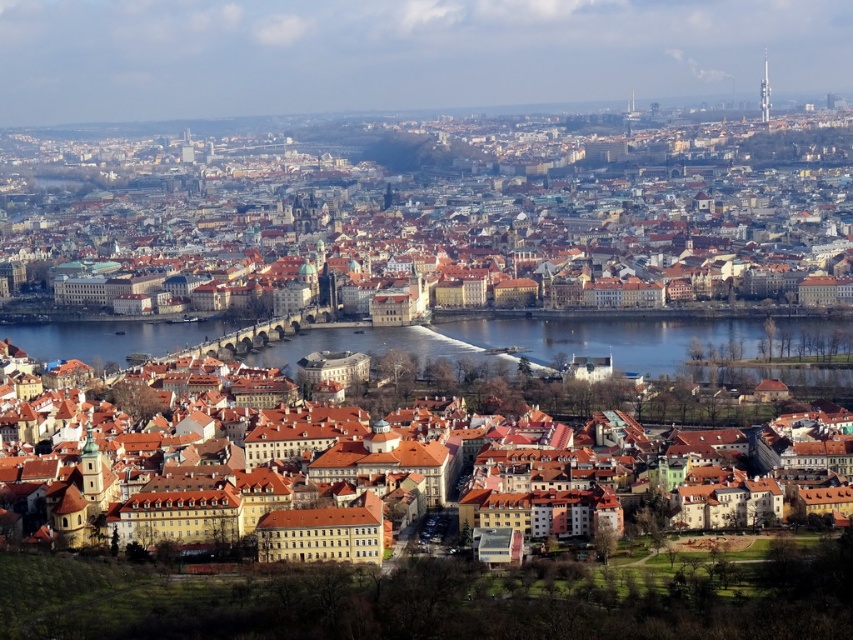
Image resolution: width=853 pixels, height=640 pixels. What do you see at coordinates (434, 218) in the screenshot?
I see `brown tiled roofs at center` at bounding box center [434, 218].

Is brown tiled roofs at center closer to the viewer compared to brown textured buildings at center?

No, it is not.

Is point (97, 212) positioned after point (724, 404)?

Yes.

At what (x,y) coordinates should I click in order to perform the action: click on brown tiled roofs at center. Please return your answer as a coordinate pair (x, y). This screenshot has width=853, height=640. Looking at the image, I should click on (434, 218).

Which is more to the right, blue water at center or brown textured buildings at center?

brown textured buildings at center

Is point (525, 323) positioned after point (584, 416)?

Yes.

Which is in front, point (113, 332) or point (519, 378)?

Point (519, 378) is in front.

The image size is (853, 640). I want to click on blue water at center, so 534,340.

Is brown tiled roofs at center thinner than blue water at center?

No.

Who is higher up, brown tiled roofs at center or blue water at center?

Answer: brown tiled roofs at center

Locate an element on the screen. The image size is (853, 640). brown tiled roofs at center is located at coordinates (434, 218).